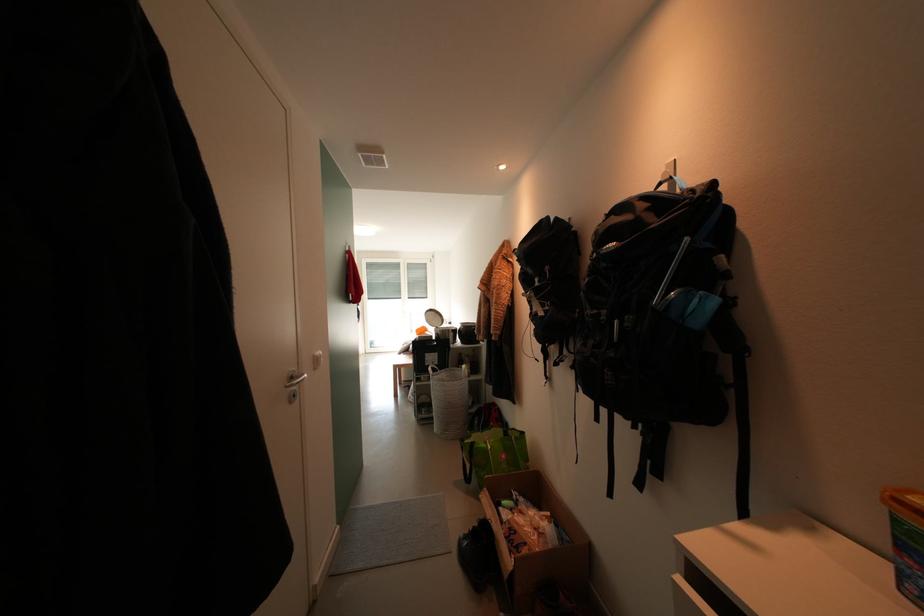
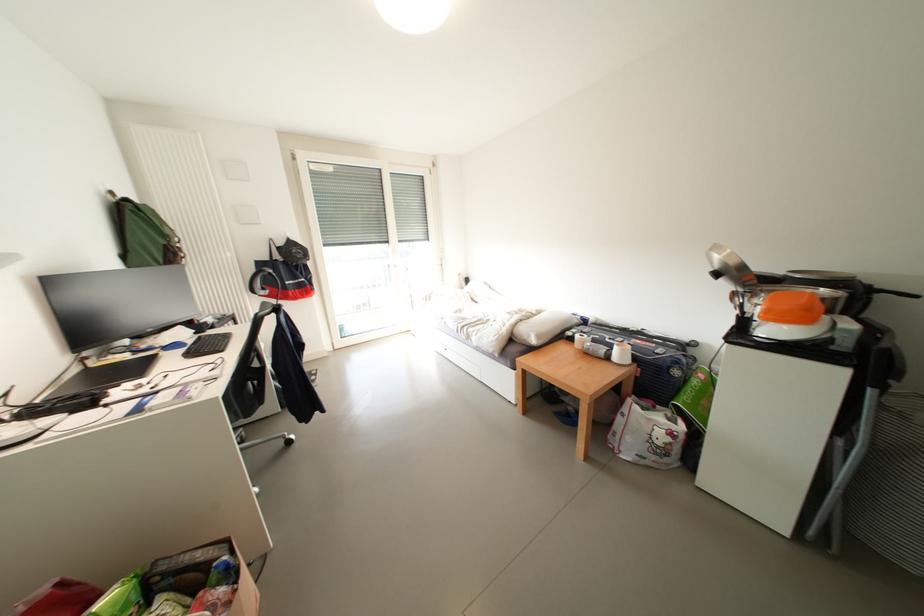
What movement of the cameraman would produce the second image?

The cameraman moved toward left, forward.